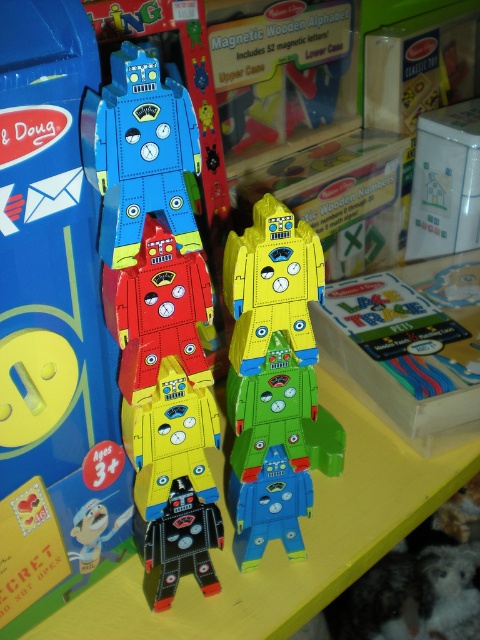
Question: From the image, what is the correct spatial relationship of yellow matte robot at center in relation to matte plastic robot at center?

Choices:
 (A) below
 (B) above

Answer: (B)

Question: Which point appears farthest from the camera in this image?

Choices:
 (A) (118, 164)
 (B) (120, 387)
 (C) (162, 364)

Answer: (B)

Question: Considering the real-world distances, which object is closest to the yellow matte robot at center?

Choices:
 (A) matte plastic robot at center
 (B) matte cardboard robot at center
 (C) shiny black robot at center

Answer: (B)

Question: Among these objects, which one is farthest from the camera?

Choices:
 (A) yellow matte robot at center
 (B) shiny red robot at center
 (C) blue matte robot at center

Answer: (C)

Question: Does yellow matte robot at center appear under blue matte robot at center?

Choices:
 (A) no
 (B) yes

Answer: (A)

Question: Is yellow matte robot at center behind shiny black robot at center?

Choices:
 (A) yes
 (B) no

Answer: (B)